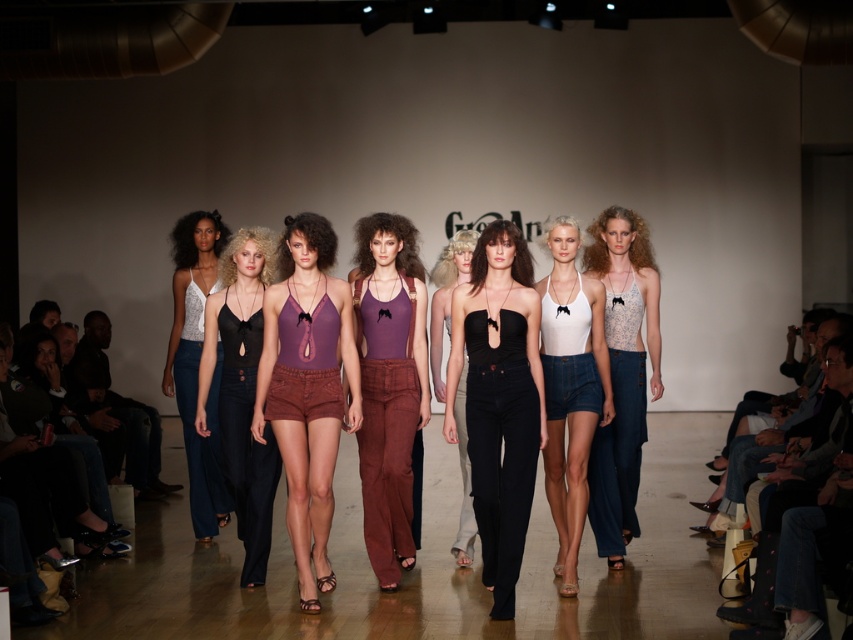
Question: In this image, where is purple linen tank top at center located relative to matte white tank top at left?

Choices:
 (A) left
 (B) right

Answer: (B)

Question: Among these objects, which one is farthest from the camera?

Choices:
 (A) matte purple tank top at center
 (B) white matte halter top at center

Answer: (B)

Question: Does purple fabric shorts at center have a lesser width compared to matte purple tank top at center?

Choices:
 (A) yes
 (B) no

Answer: (B)

Question: Which of the following is the farthest from the observer?

Choices:
 (A) white matte halter top at center
 (B) black matte halter top at center
 (C) matte purple tank top at center

Answer: (B)

Question: Which object is positioned farthest from the light blue denim skirt at right?

Choices:
 (A) purple linen tank top at center
 (B) black matte top at center
 (C) white matte halter top at center

Answer: (A)

Question: Is black matte top at center closer to the viewer compared to black matte halter top at center?

Choices:
 (A) yes
 (B) no

Answer: (A)